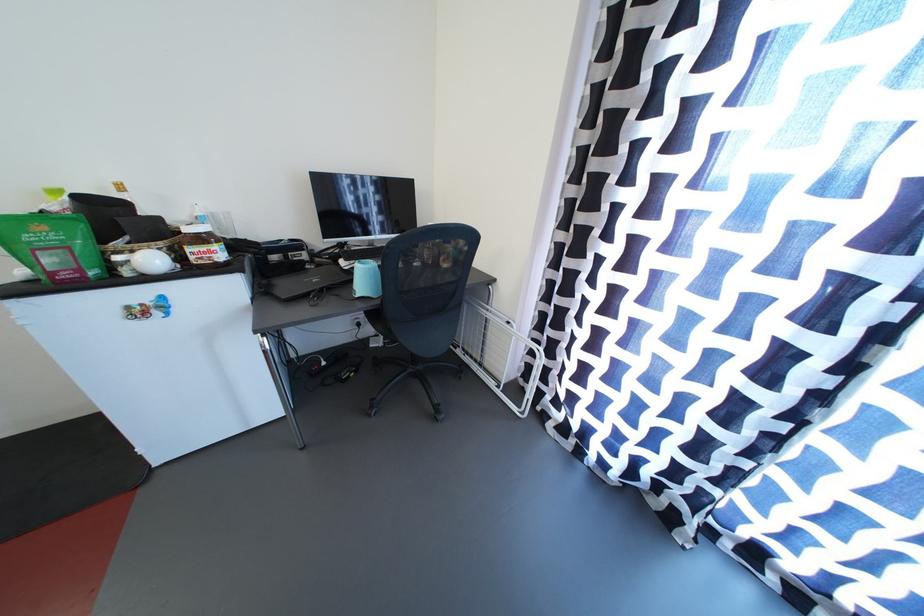
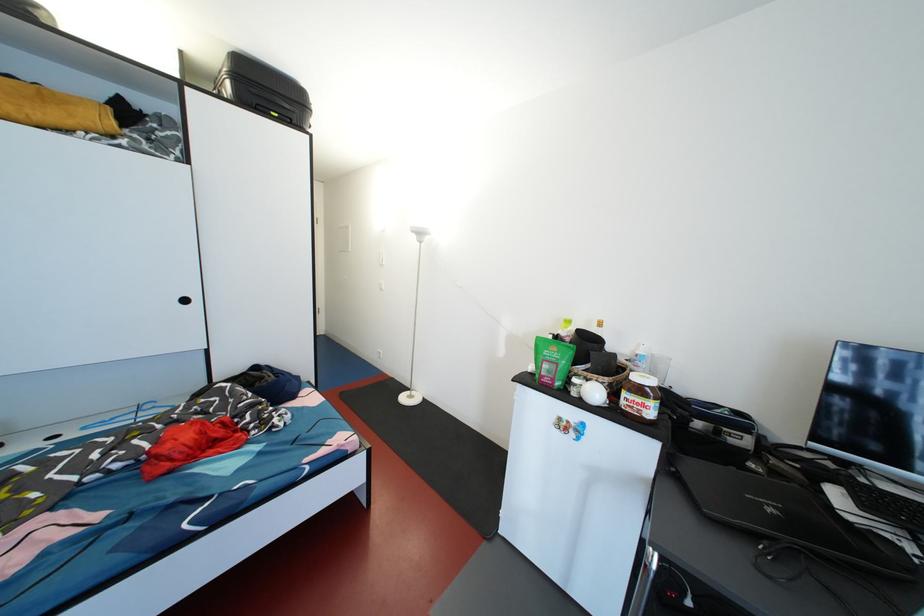
Question: The camera is either moving clockwise (left) or counter-clockwise (right) around the object. The first image is from the beginning of the video and the second image is from the end. Is the camera moving left or right when shooting the video?

Choices:
 (A) Left
 (B) Right

Answer: (B)